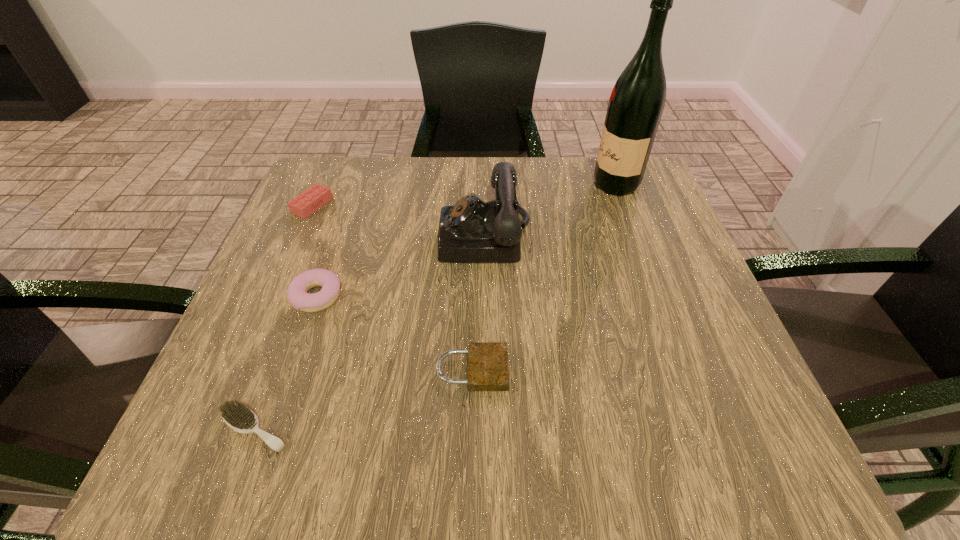
Identify the location of vacant area that lies between the second nearest object and the doughnut. (395, 334).

Where is `empty space between the liquor and the fifth farthest object`? This screenshot has width=960, height=540. empty space between the liquor and the fifth farthest object is located at coordinates (543, 278).

The width and height of the screenshot is (960, 540). Identify the location of vacant space that's between the doughnut and the scrubbing brush. (286, 362).

Image resolution: width=960 pixels, height=540 pixels. I want to click on vacant space in between the doughnut and the scrubbing brush, so click(x=286, y=362).

Select which object is the closest to the nearest object. Please provide its 2D coordinates. Your answer should be formatted as a tuple, i.e. [(x, y)], where the tuple contains the x and y coordinates of a point satisfying the conditions above.

[(297, 290)]

Locate which object ranks second in proximity to the telephone. Please provide its 2D coordinates. Your answer should be formatted as a tuple, i.e. [(x, y)], where the tuple contains the x and y coordinates of a point satisfying the conditions above.

[(636, 104)]